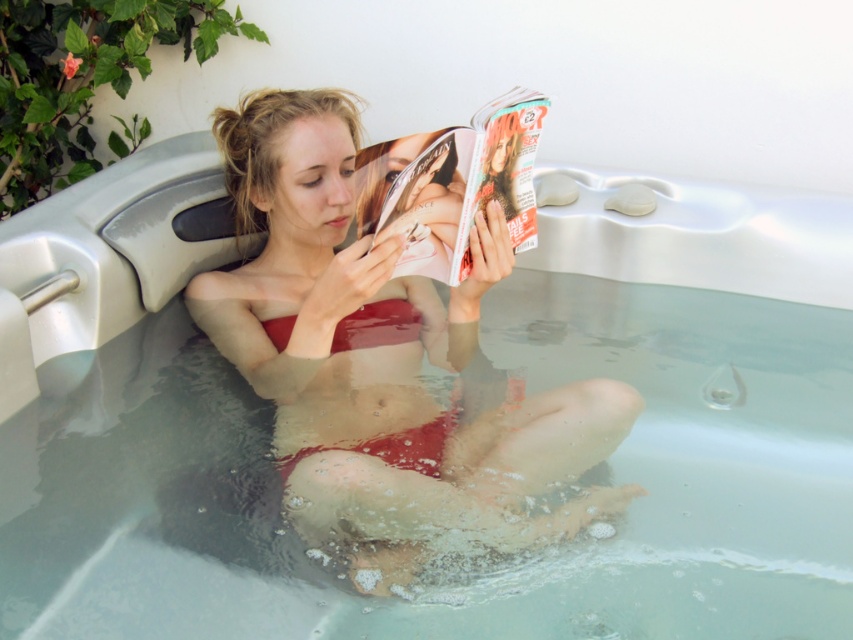
Between matte red bikini at center and matte glossy magazine at center, which one is positioned higher?

Positioned higher is matte glossy magazine at center.

Does matte red bikini at center have a lesser height compared to matte glossy magazine at center?

No.

This screenshot has height=640, width=853. What are the coordinates of `matte red bikini at center` in the screenshot? It's located at (386, 364).

At what (x,y) coordinates should I click in order to perform the action: click on matte red bikini at center. Please return your answer as a coordinate pair (x, y). The height and width of the screenshot is (640, 853). Looking at the image, I should click on (386, 364).

Between matte glossy magazine at center and matte red bikini top at center, which one has less height?

matte red bikini top at center is shorter.

Does matte glossy magazine at center appear on the left side of matte red bikini top at center?

In fact, matte glossy magazine at center is to the right of matte red bikini top at center.

Is point (451, 216) farther from viewer compared to point (383, 337)?

No, it is in front of (383, 337).

You are a GUI agent. You are given a task and a screenshot of the screen. Output one action in this format:
    pyautogui.click(x=<x>, y=<y>)
    Task: Click on the matte glossy magazine at center
    This screenshot has height=640, width=853.
    Given the screenshot: What is the action you would take?
    pyautogui.click(x=453, y=184)

Is matte red bikini at center taller than matte red bikini top at center?

Indeed, matte red bikini at center has a greater height compared to matte red bikini top at center.

Between matte red bikini at center and matte red bikini top at center, which one appears on the left side from the viewer's perspective?

Positioned to the left is matte red bikini top at center.

Does point (468, 426) lie in front of point (267, 326)?

Yes, it is.

Where is `matte red bikini at center`? matte red bikini at center is located at coordinates (386, 364).